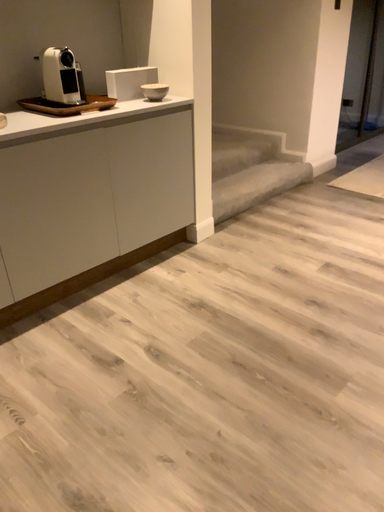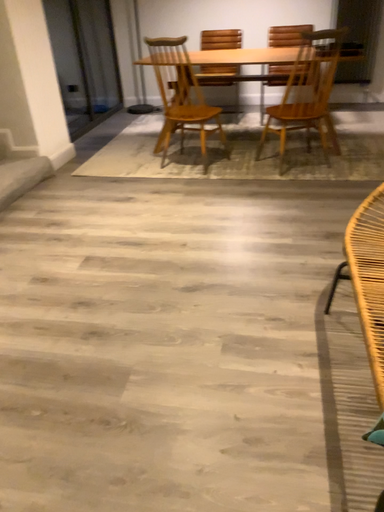
Question: Which way did the camera rotate in the video?

Choices:
 (A) rotated right
 (B) rotated left

Answer: (A)